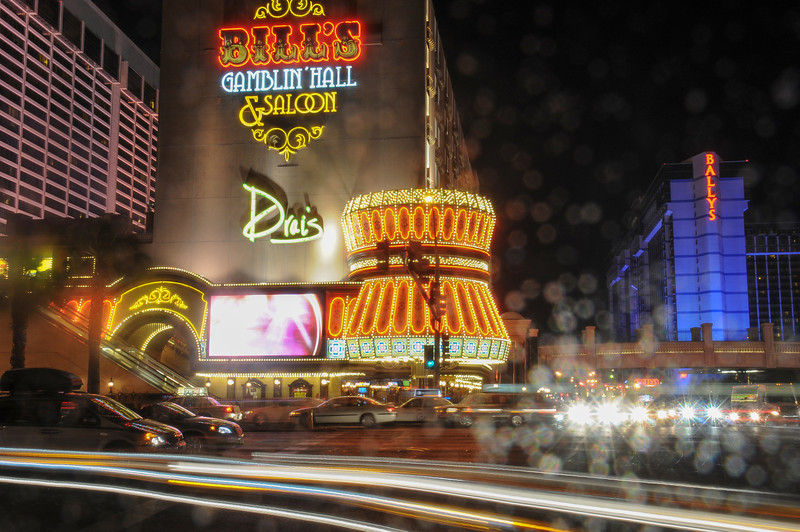
I want to click on light, so click(686, 414).